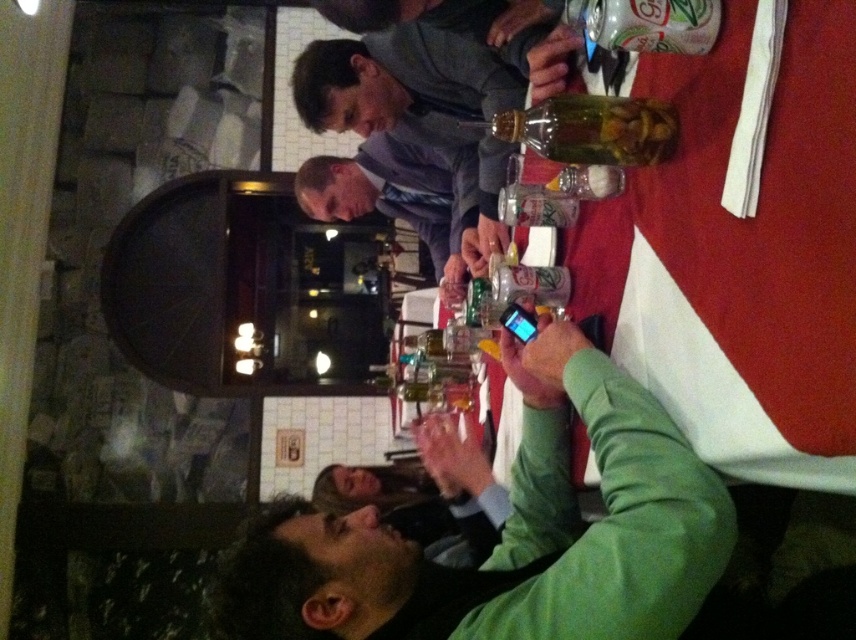
Question: Which point is farther to the camera?

Choices:
 (A) clear glass bottle at upper center
 (B) green matte phone at center
 (C) matte gray shirt at center
 (D) translucent glass bottle at upper right

Answer: (C)

Question: Can you confirm if green matte phone at center is positioned above matte gray shirt at center?

Choices:
 (A) no
 (B) yes

Answer: (A)

Question: Can you confirm if green matte phone at center is smaller than translucent glass bottle at upper right?

Choices:
 (A) yes
 (B) no

Answer: (B)

Question: Based on their relative distances, which object is farther from the green matte phone at center?

Choices:
 (A) translucent glass bottle at upper right
 (B) matte gray shirt at center
 (C) clear glass bottle at upper center

Answer: (B)

Question: Is green matte phone at center smaller than matte gray shirt at center?

Choices:
 (A) no
 (B) yes

Answer: (A)

Question: Considering the real-world distances, which object is farthest from the translucent glass bottle at upper right?

Choices:
 (A) clear glass bottle at upper center
 (B) green matte phone at center

Answer: (B)